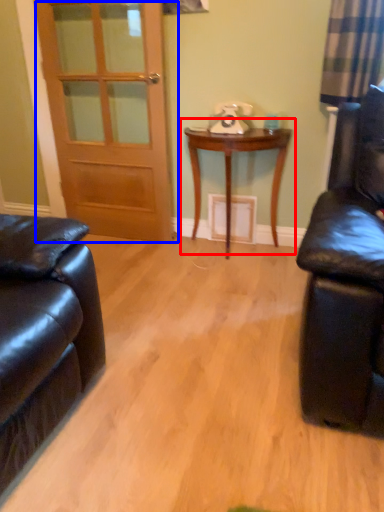
Question: Which object appears farthest to the camera in this image, table (highlighted by a red box) or door (highlighted by a blue box)?

Choices:
 (A) table
 (B) door

Answer: (B)